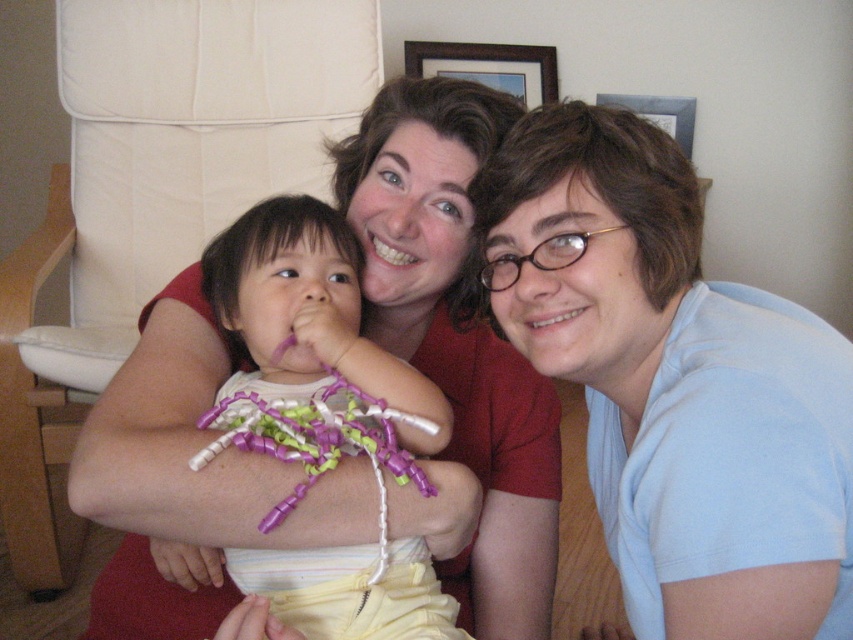
Is matte plastic toy at center smaller than purple plastic toy at center?

No.

Is matte plastic toy at center to the right of purple plastic toy at center from the viewer's perspective?

Incorrect, matte plastic toy at center is not on the right side of purple plastic toy at center.

Does point (343, 224) come closer to viewer compared to point (316, 572)?

No.

Identify the location of matte plastic toy at center. Image resolution: width=853 pixels, height=640 pixels. (308, 314).

Consider the image. Who is taller, blue cotton shirt at upper right or matte plastic toy at center?

blue cotton shirt at upper right is taller.

Does blue cotton shirt at upper right appear under matte plastic toy at center?

Actually, blue cotton shirt at upper right is above matte plastic toy at center.

In order to click on blue cotton shirt at upper right in this screenshot , I will do `click(674, 381)`.

Is white fabric armchair at upper left below matte plastic toy at center?

No.

Is white fabric armchair at upper left smaller than matte plastic toy at center?

No, white fabric armchair at upper left is not smaller than matte plastic toy at center.

Is point (140, 180) positioned before point (318, 573)?

No, it is behind (318, 573).

I want to click on white fabric armchair at upper left, so click(x=184, y=144).